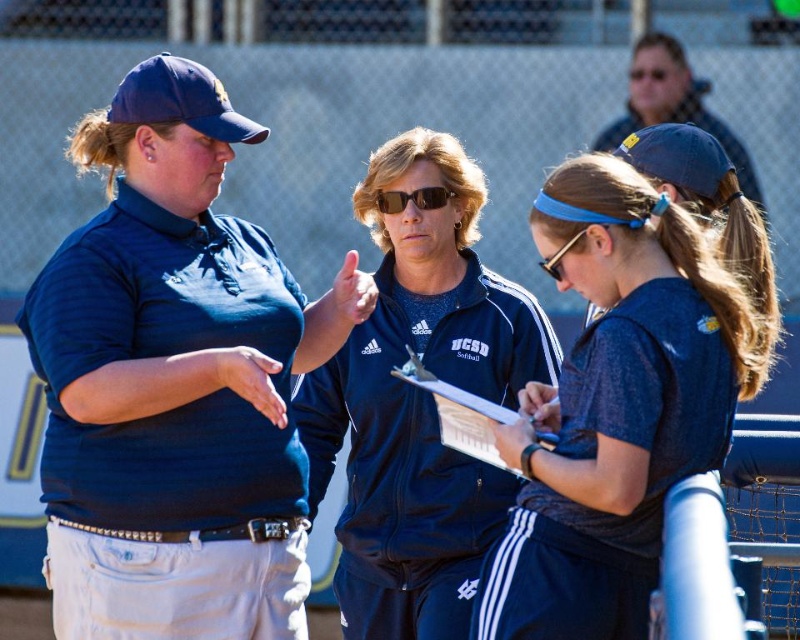
You are a photographer positioned behind the two women at center. You want to take a photo that includes both the blue fabric headband at center and the sunglasses at center. Which object should you adjust your focus on to ensure both are in frame?

The blue fabric headband at center is taller than the sunglasses at center, so you should focus on the blue fabric headband at center to ensure both are in frame.